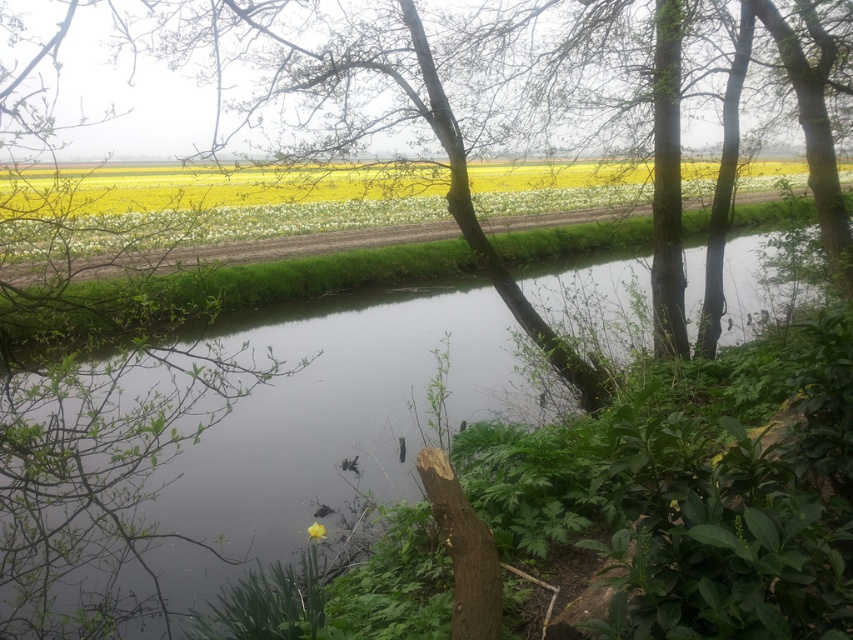
Does clear water at center have a smaller size compared to yellow matte flowers at upper center?

Indeed, clear water at center has a smaller size compared to yellow matte flowers at upper center.

Does point (747, 509) lie in front of point (334, 204)?

Yes, point (747, 509) is closer to viewer.

Does point (270, 513) come closer to viewer compared to point (747, 179)?

That is True.

I want to click on clear water at center, so click(194, 454).

Who is shorter, yellow matte flowers at upper center or yellow matte flower at center?

With less height is yellow matte flower at center.

I want to click on yellow matte flowers at upper center, so click(242, 221).

Which is in front, point (44, 568) or point (309, 529)?

Positioned in front is point (44, 568).

Between point (396, 406) and point (308, 538), which one is positioned behind?

Positioned behind is point (396, 406).

I want to click on clear water at center, so pyautogui.click(x=194, y=454).